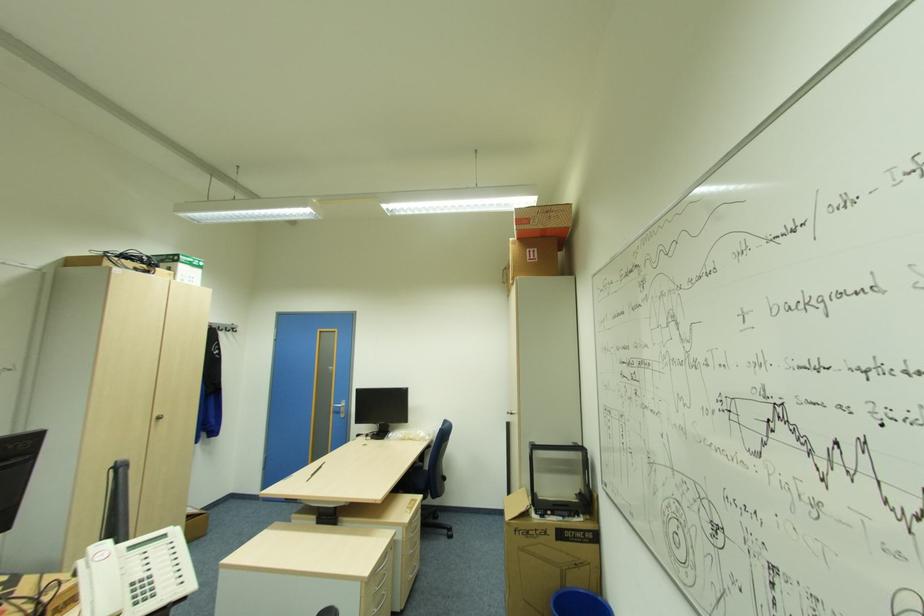
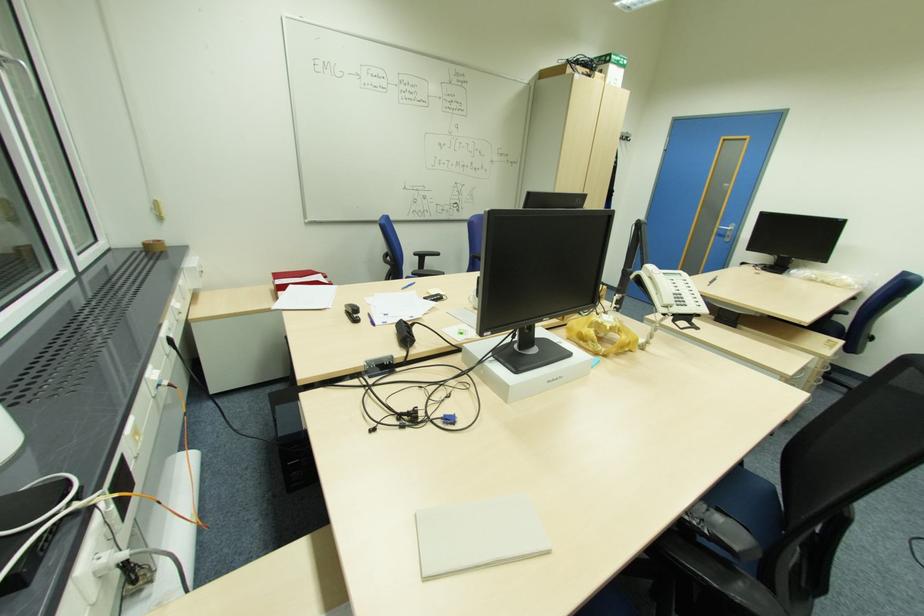
Find the pixel in the second image that matches (x=429, y=469) in the first image.

(839, 322)